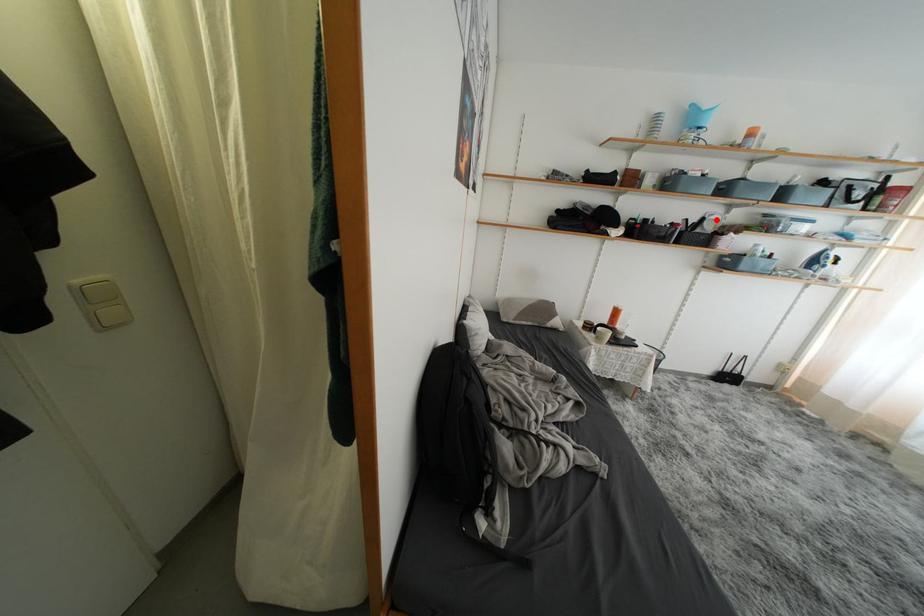
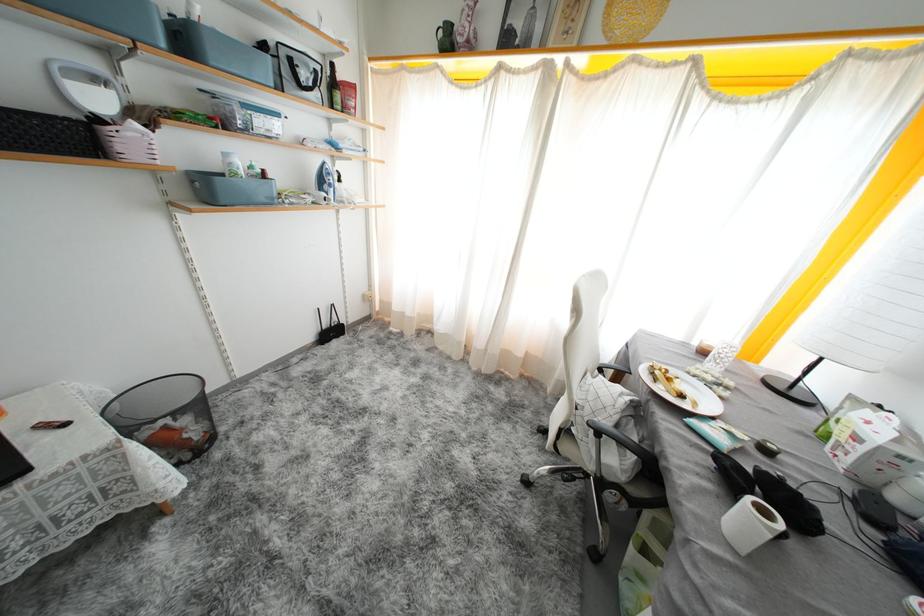
Find the pixel in the second image that matches the highlighted location in the first image.

(103, 84)